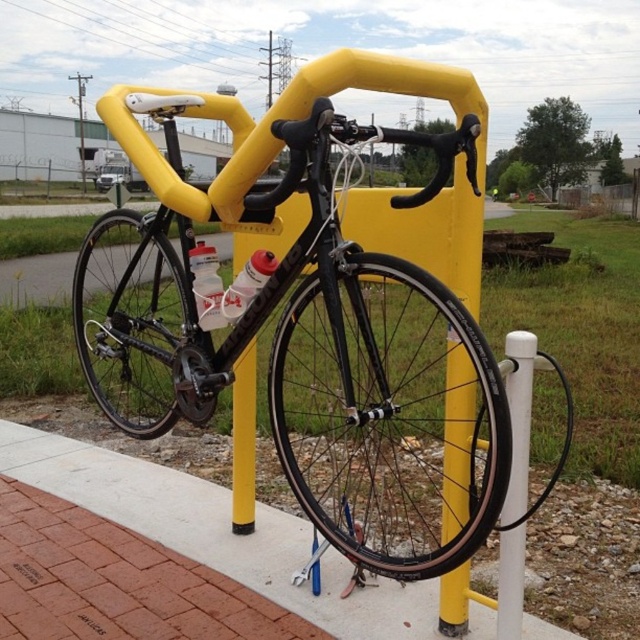
Question: Observing the image, what is the correct spatial positioning of concrete at lower left in reference to white plastic post at lower right?

Choices:
 (A) left
 (B) right

Answer: (A)

Question: Can you confirm if concrete at lower left is thinner than white plastic post at lower right?

Choices:
 (A) no
 (B) yes

Answer: (A)

Question: Which object is closer to the camera taking this photo?

Choices:
 (A) concrete at lower left
 (B) white plastic post at lower right
 (C) matte black bicycle at center

Answer: (C)

Question: Which of the following is the farthest from the observer?

Choices:
 (A) concrete at lower left
 (B) white plastic post at lower right

Answer: (A)

Question: Which of these objects is positioned farthest from the concrete at lower left?

Choices:
 (A) white matte bottle at center
 (B) white plastic post at lower right
 (C) matte black bicycle at center

Answer: (B)

Question: Is matte black bicycle at center closer to camera compared to white matte bottle at center?

Choices:
 (A) yes
 (B) no

Answer: (A)